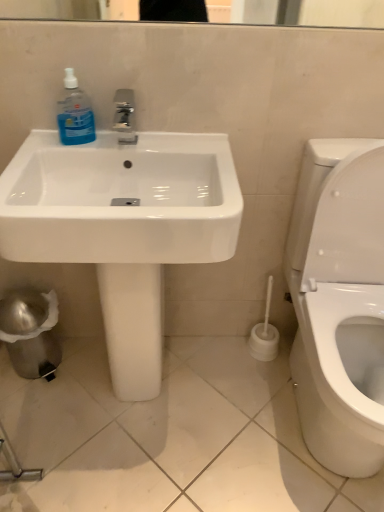
Question: Is white glossy sink at center looking in the opposite direction of blue translucent liquid at sink left?

Choices:
 (A) yes
 (B) no

Answer: (A)

Question: Would you consider white glossy sink at center to be distant from blue translucent liquid at sink left?

Choices:
 (A) yes
 (B) no

Answer: (B)

Question: Is white glossy sink at center positioned behind blue translucent liquid at sink left?

Choices:
 (A) yes
 (B) no

Answer: (B)

Question: Does white glossy sink at center have a lesser height compared to blue translucent liquid at sink left?

Choices:
 (A) yes
 (B) no

Answer: (B)

Question: Does white glossy sink at center have a greater width compared to blue translucent liquid at sink left?

Choices:
 (A) no
 (B) yes

Answer: (B)

Question: Would you say white glossy sink at center contains blue translucent liquid at sink left?

Choices:
 (A) no
 (B) yes

Answer: (B)

Question: Is blue translucent liquid at sink left far away from white glossy sink at center?

Choices:
 (A) yes
 (B) no

Answer: (B)

Question: Can you confirm if blue translucent liquid at sink left is taller than white glossy sink at center?

Choices:
 (A) no
 (B) yes

Answer: (A)

Question: Does blue translucent liquid at sink left appear on the right side of white glossy sink at center?

Choices:
 (A) yes
 (B) no

Answer: (B)

Question: From a real-world perspective, is blue translucent liquid at sink left located beneath white glossy sink at center?

Choices:
 (A) yes
 (B) no

Answer: (B)

Question: From a real-world perspective, is blue translucent liquid at sink left over white glossy sink at center?

Choices:
 (A) yes
 (B) no

Answer: (A)

Question: From the image's perspective, would you say blue translucent liquid at sink left is shown under white glossy sink at center?

Choices:
 (A) yes
 (B) no

Answer: (B)

Question: Looking at the image, does blue translucent liquid at sink left seem bigger or smaller compared to white glossy sink at center?

Choices:
 (A) small
 (B) big

Answer: (A)